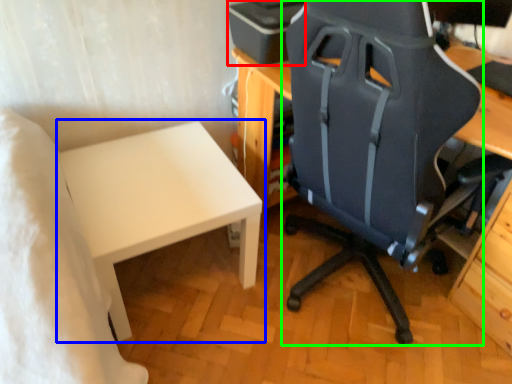
Question: Which object is the closest to the printer (highlighted by a red box)? Choose among these: table (highlighted by a blue box) or chair (highlighted by a green box).

Choices:
 (A) table
 (B) chair

Answer: (B)